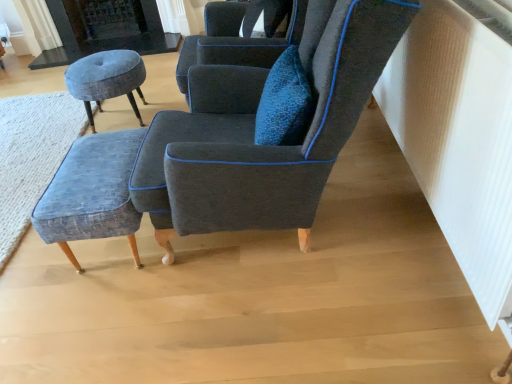
Where is `free point above textured blue fabric stool at lower left, placed as the 1th stool when sorted from bottom to top (from a real-world perspective)`? The height and width of the screenshot is (384, 512). free point above textured blue fabric stool at lower left, placed as the 1th stool when sorted from bottom to top (from a real-world perspective) is located at coordinates (93, 164).